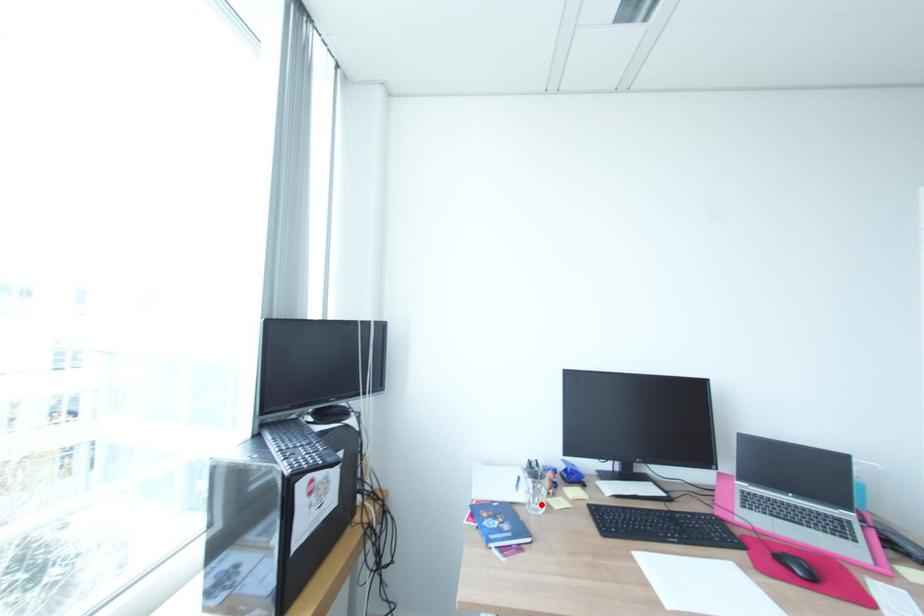
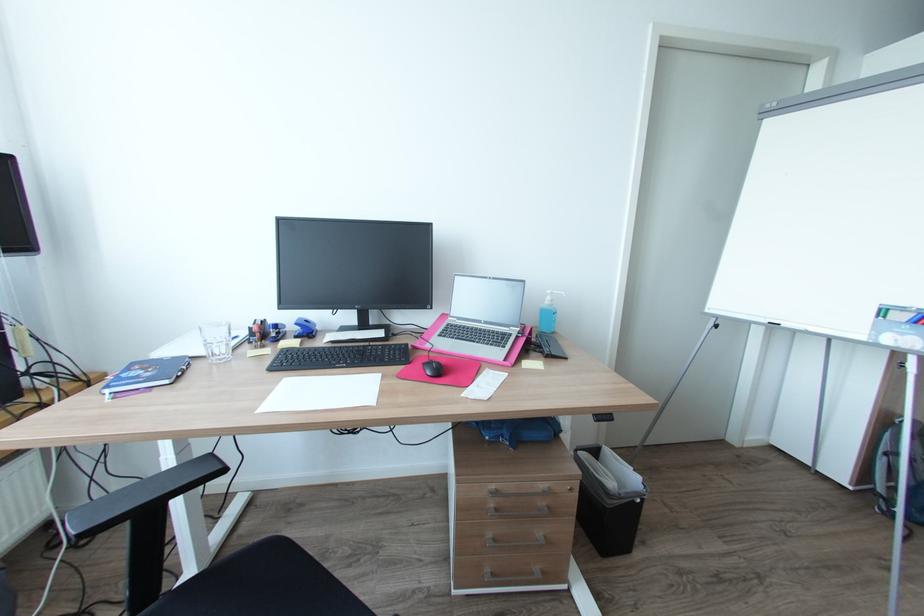
Question: I am providing you with two images of the same scene from different viewpoints. A red point is shown in image1. For the corresponding object point in image2, is it positioned nearer or farther from the camera?

Choices:
 (A) Nearer
 (B) Farther

Answer: (A)